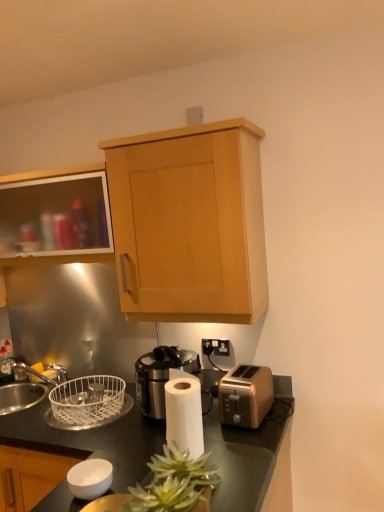
The image size is (384, 512). I want to click on vacant point above gold metallic toaster at lower right (from a real-world perspective), so click(x=249, y=372).